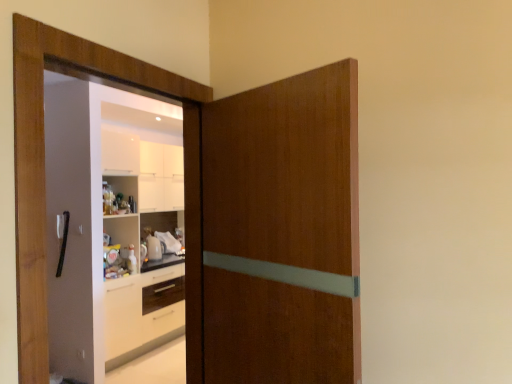
Question: From the image's perspective, is black plastic door handle at left on top of wooden screen door at left?

Choices:
 (A) no
 (B) yes

Answer: (A)

Question: Considering the relative sizes of black plastic door handle at left and wooden screen door at left in the image provided, is black plastic door handle at left taller than wooden screen door at left?

Choices:
 (A) yes
 (B) no

Answer: (B)

Question: Is black plastic door handle at left oriented away from wooden screen door at left?

Choices:
 (A) no
 (B) yes

Answer: (A)

Question: Is black plastic door handle at left beside wooden screen door at left?

Choices:
 (A) no
 (B) yes

Answer: (A)

Question: Is the depth of black plastic door handle at left less than that of wooden screen door at left?

Choices:
 (A) no
 (B) yes

Answer: (A)

Question: From the image's perspective, relative to wooden door at center, is black plastic door handle at left above or below?

Choices:
 (A) above
 (B) below

Answer: (B)

Question: Considering the positions of black plastic door handle at left and wooden door at center in the image, is black plastic door handle at left taller or shorter than wooden door at center?

Choices:
 (A) tall
 (B) short

Answer: (B)

Question: In terms of width, does black plastic door handle at left look wider or thinner when compared to wooden door at center?

Choices:
 (A) wide
 (B) thin

Answer: (B)

Question: Considering their positions, is black plastic door handle at left located in front of or behind wooden door at center?

Choices:
 (A) behind
 (B) front

Answer: (A)

Question: In terms of width, does wooden door at center look wider or thinner when compared to wooden screen door at left?

Choices:
 (A) wide
 (B) thin

Answer: (A)

Question: Looking at the image, does wooden door at center seem bigger or smaller compared to wooden screen door at left?

Choices:
 (A) small
 (B) big

Answer: (B)

Question: Would you say wooden door at center is to the left or to the right of wooden screen door at left in the picture?

Choices:
 (A) left
 (B) right

Answer: (B)

Question: Is wooden door at center situated inside wooden screen door at left or outside?

Choices:
 (A) outside
 (B) inside

Answer: (A)

Question: Considering the relative positions of wooden screen door at left and wooden door at center in the image provided, is wooden screen door at left to the left or to the right of wooden door at center?

Choices:
 (A) right
 (B) left

Answer: (B)

Question: Does point (87, 296) appear closer or farther from the camera than point (245, 279)?

Choices:
 (A) closer
 (B) farther

Answer: (B)